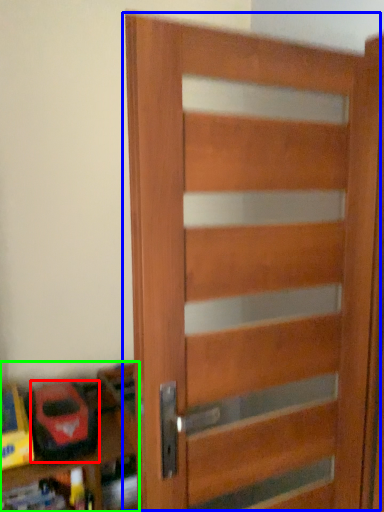
Question: Which is nearer to the toy (highlighted by a red box)? door (highlighted by a blue box) or shelf (highlighted by a green box).

Choices:
 (A) door
 (B) shelf

Answer: (B)